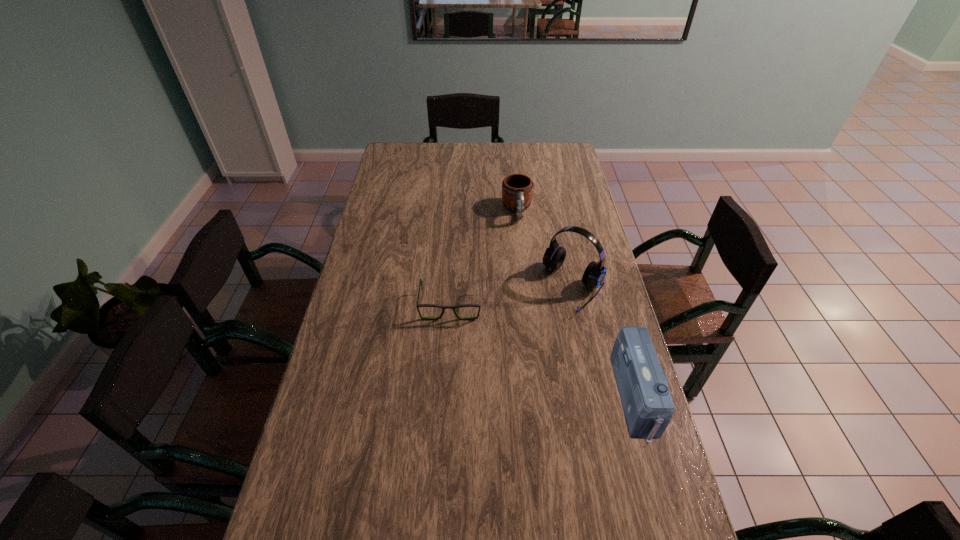
This screenshot has height=540, width=960. Find the location of `free region located 0.370m on the side of the third tallest object with the handle`. free region located 0.370m on the side of the third tallest object with the handle is located at coordinates (529, 294).

You are a GUI agent. You are given a task and a screenshot of the screen. Output one action in this format:
    pyautogui.click(x=<x>, y=<y>)
    Task: Click on the free space located 0.280m on the ear cushions of the headset
    The image size is (960, 540).
    Given the screenshot: What is the action you would take?
    pyautogui.click(x=513, y=372)

The height and width of the screenshot is (540, 960). Find the location of `blank space located on the ear cushions of the headset`. blank space located on the ear cushions of the headset is located at coordinates (489, 402).

Where is `vacant space located 0.390m on the ear cushions of the headset`? The image size is (960, 540). vacant space located 0.390m on the ear cushions of the headset is located at coordinates (492, 400).

Find the location of `camera positioned at the right edge`. camera positioned at the right edge is located at coordinates (642, 384).

Locate an element on the screen. This screenshot has height=540, width=960. headset situated at the right edge is located at coordinates (554, 256).

In the image, there is a desktop. Find the location of `vacant space at the far edge`. vacant space at the far edge is located at coordinates (470, 152).

Locate an element on the screen. The width and height of the screenshot is (960, 540). free location at the left edge is located at coordinates (342, 324).

In the image, there is a desktop. Where is `free space at the right edge`? This screenshot has height=540, width=960. free space at the right edge is located at coordinates (610, 320).

Where is `blank space at the far left corner of the desktop`? The width and height of the screenshot is (960, 540). blank space at the far left corner of the desktop is located at coordinates (401, 164).